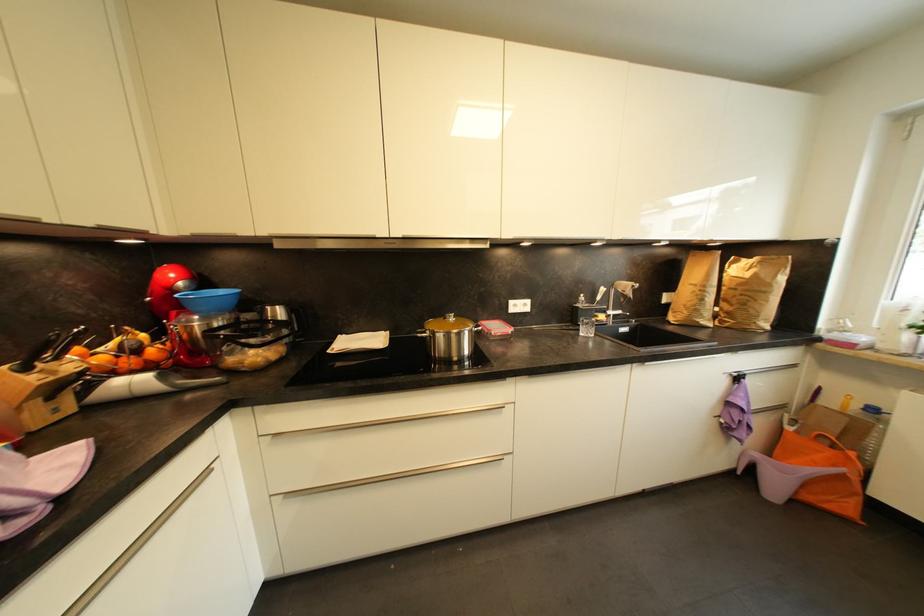
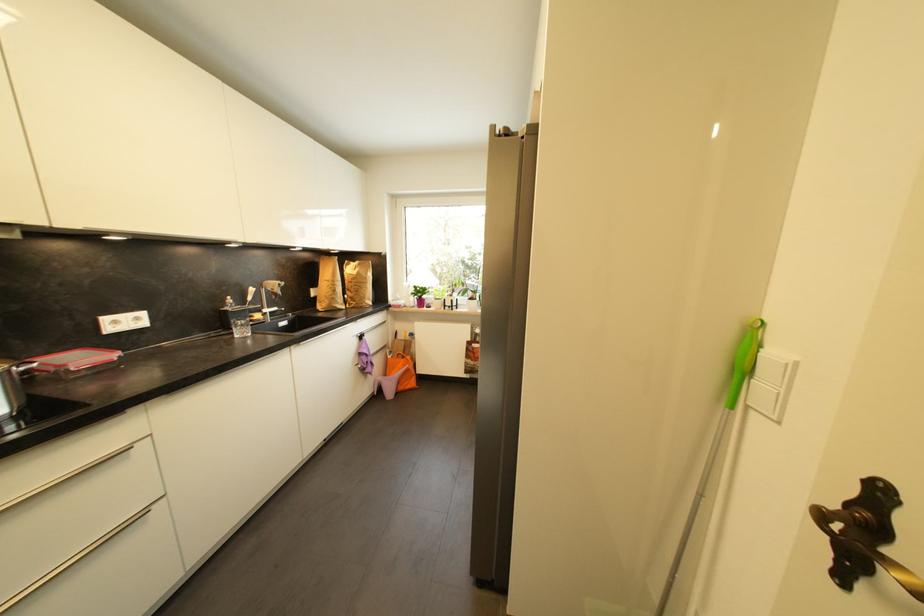
In the second image, find the point that corresponds to pixel 744 286 in the first image.

(358, 281)